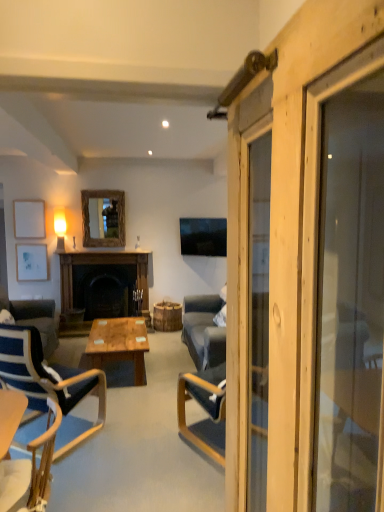
Question: Relative to wooden frame mirror at upper center, is white matte picture frame at upper left, the 1th picture frame from the top, in front or behind?

Choices:
 (A) front
 (B) behind

Answer: (A)

Question: From the image's perspective, relative to wooden frame mirror at upper center, is white matte picture frame at upper left, the 1th picture frame from the top, above or below?

Choices:
 (A) above
 (B) below

Answer: (B)

Question: Estimate the real-world distances between objects in this image. Which object is farther from the wooden frame mirror at upper center?

Choices:
 (A) wooden chair at lower left, the 2th chair from the back
 (B) wooden barn door at right
 (C) white matte picture frame at upper left, the 1th picture frame from the top
 (D) dark stone fireplace at center
 (E) white matte picture frame at left, the 1th picture frame ordered from the bottom

Answer: (B)

Question: Which object is the closest to the blue fabric chair at left, which is the 1th chair in back-to-front order?

Choices:
 (A) wooden frame mirror at upper center
 (B) wooden barn door at right
 (C) dark stone fireplace at center
 (D) wooden polished coffee table at center
 (E) white matte picture frame at left, positioned as the second picture frame in top-to-bottom order

Answer: (D)